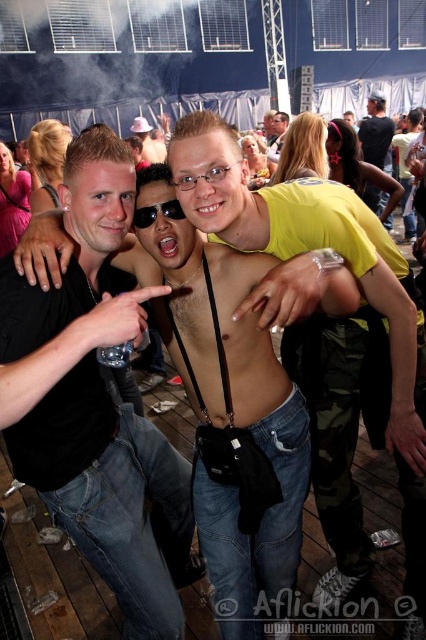
Based on the photo, who is positioned more to the left, shiny black camera at center or black plastic sunglasses at center?

black plastic sunglasses at center is more to the left.

Who is lower down, shiny black camera at center or black plastic sunglasses at center?

Positioned lower is shiny black camera at center.

Who is more forward, (244, 209) or (157, 204)?

Point (157, 204) is in front.

Find the location of a particular element. This screenshot has width=426, height=640. shiny black camera at center is located at coordinates (325, 332).

Measure the distance from shiny black sunglasses at upper right to black plastic sunglasses at center.

shiny black sunglasses at upper right and black plastic sunglasses at center are 5.46 meters apart from each other.

The height and width of the screenshot is (640, 426). Describe the element at coordinates (376, 131) in the screenshot. I see `shiny black sunglasses at upper right` at that location.

Where is `shiny black sunglasses at upper right`? This screenshot has height=640, width=426. shiny black sunglasses at upper right is located at coordinates (376, 131).

Image resolution: width=426 pixels, height=640 pixels. I want to click on shiny black sunglasses at upper right, so click(x=376, y=131).

Is shiny black sunglasses at upper right to the right of matte black camera at center from the viewer's perspective?

Yes, shiny black sunglasses at upper right is to the right of matte black camera at center.

Does shiny black sunglasses at upper right have a smaller size compared to matte black camera at center?

Incorrect, shiny black sunglasses at upper right is not smaller in size than matte black camera at center.

What do you see at coordinates (376, 131) in the screenshot?
I see `shiny black sunglasses at upper right` at bounding box center [376, 131].

Locate an element on the screen. Image resolution: width=426 pixels, height=640 pixels. shiny black sunglasses at upper right is located at coordinates (376, 131).